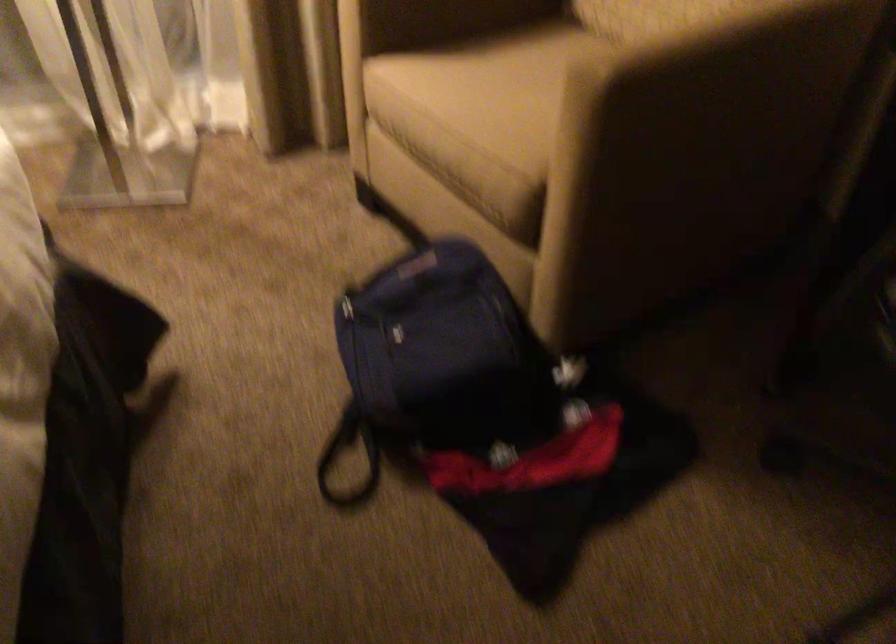
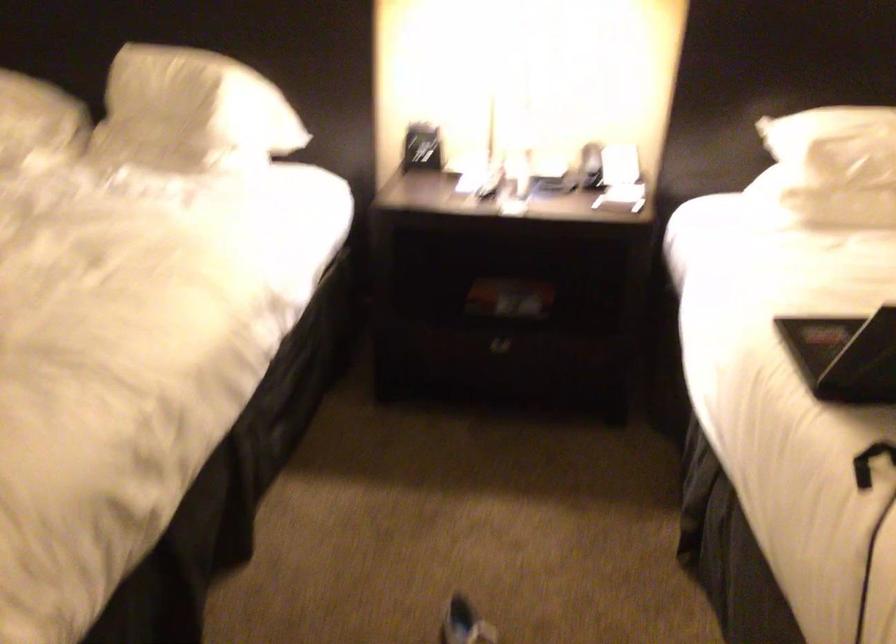
The images are taken continuously from a first-person perspective. In which direction is your viewpoint rotating?

The camera rotated toward left-down.